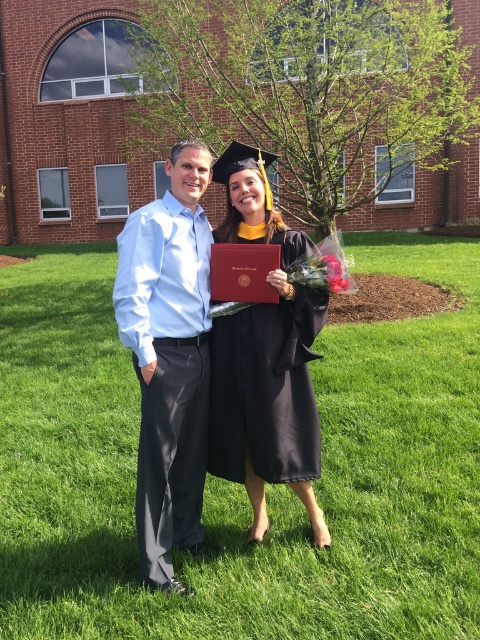
You are a photographer at the graduation ceremony. You need to ensure both the light blue shirt at center and the black matte graduation gown at center are clearly visible in the photo. Given their sizes, which one might require more focus adjustment to capture details?

The light blue shirt at center has a larger size compared to the black matte graduation gown at center, so it might require more focus adjustment to capture details due to its larger size.

You are a photographer at the graduation ceremony. You want to capture a photo where both the light blue shirt at center and the black matte graduation gown at center are fully visible. Considering their widths, which object should be positioned closer to the camera to ensure both fit in the frame?

The light blue shirt at center has a lesser width compared to the black matte graduation gown at center. To ensure both fit in the frame, position the light blue shirt at center closer to the camera since its narrower width requires less space, allowing the wider gown to be accommodated in the background without being cropped.

You are a photographer at the graduation ceremony. You want to ensure both the matte black gown at center and the light blue shirt at center are fully visible in your photo. Which object requires more horizontal space in the frame?

The matte black gown at center requires more horizontal space in the frame because its width surpasses that of the light blue shirt at center.